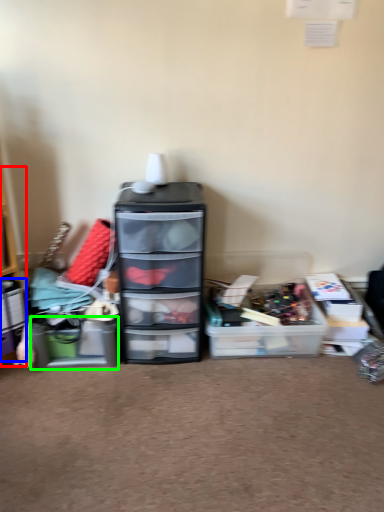
Question: Which is nearer to the shelf (highlighted by a red box)? storage box (highlighted by a blue box) or storage box (highlighted by a green box).

Choices:
 (A) storage box
 (B) storage box

Answer: (A)